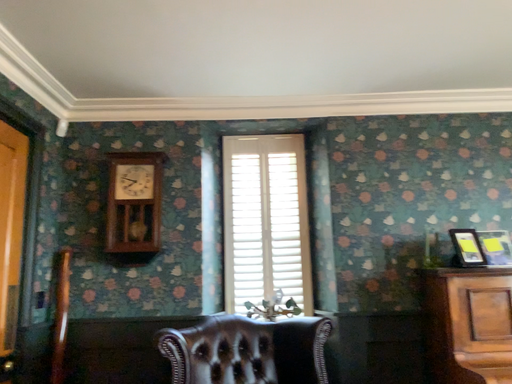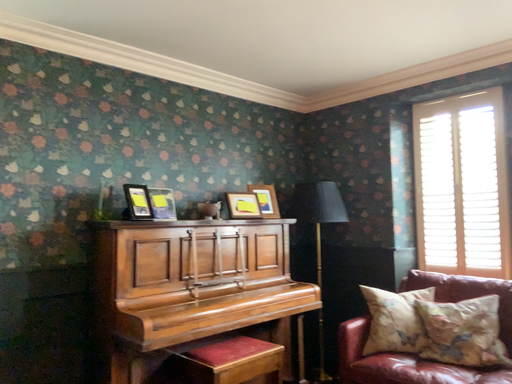
Question: How did the camera likely rotate when shooting the video?

Choices:
 (A) rotated left
 (B) rotated right

Answer: (B)